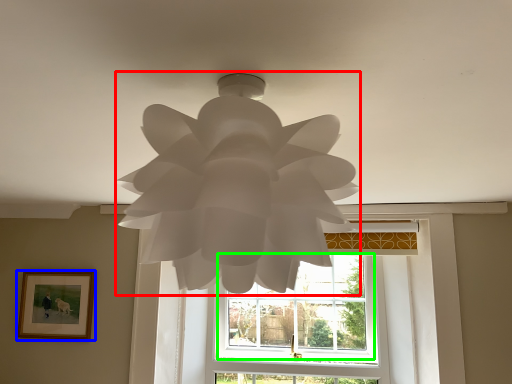
Question: Based on their relative distances, which object is farther from lamp (highlighted by a red box)? Choose from picture frame (highlighted by a blue box) and window (highlighted by a green box).

Choices:
 (A) picture frame
 (B) window

Answer: (B)